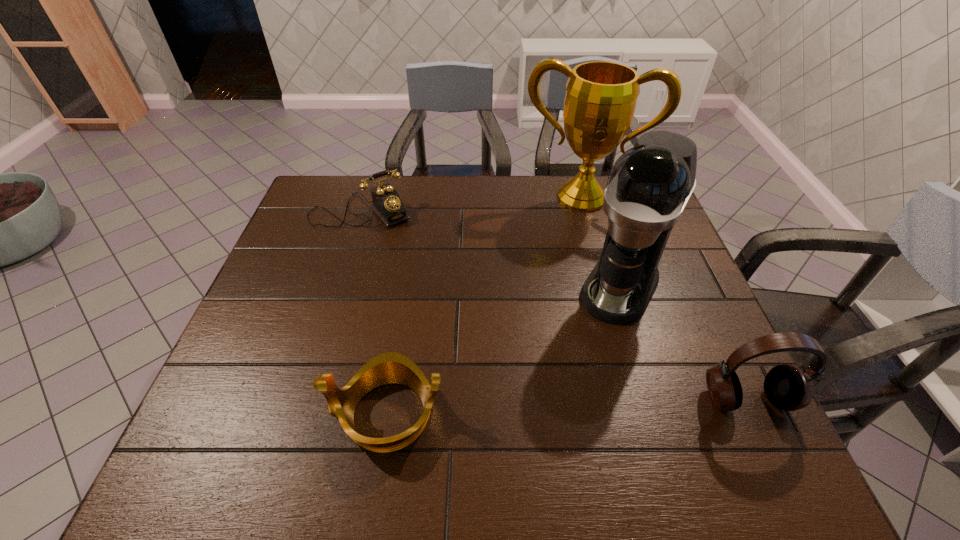
Identify the location of vacant area located 0.300m place cup under the spout of the third nearest object. (551, 414).

You are a GUI agent. You are given a task and a screenshot of the screen. Output one action in this format:
    pyautogui.click(x=<x>, y=<y>)
    Task: Click on the vacant position located 0.050m on the dial of the telephone
    This screenshot has width=960, height=540.
    Given the screenshot: What is the action you would take?
    pyautogui.click(x=393, y=235)

Where is `free location located 0.120m on the dial of the telephone`? This screenshot has width=960, height=540. free location located 0.120m on the dial of the telephone is located at coordinates (403, 248).

At what (x,y) coordinates should I click in order to perform the action: click on vacant space located 0.060m on the dial of the telephone. Please return your answer as a coordinate pair (x, y). Looking at the image, I should click on (395, 237).

At what (x,y) coordinates should I click in order to perform the action: click on free region located 0.400m on the front-facing side of the award. Please return your answer as a coordinate pair (x, y). This screenshot has height=540, width=960. Looking at the image, I should click on (550, 309).

The image size is (960, 540). Identify the location of vacant area located 0.240m on the front-facing side of the award. (560, 266).

Where is `vacant space located on the front-facing side of the award`? The width and height of the screenshot is (960, 540). vacant space located on the front-facing side of the award is located at coordinates (560, 266).

The width and height of the screenshot is (960, 540). I want to click on telephone at the far edge, so click(387, 204).

Where is `award at the far edge`? This screenshot has width=960, height=540. award at the far edge is located at coordinates (601, 96).

Find the location of a particular element. Image resolution: width=960 pixels, height=540 pixels. tiara that is at the near edge is located at coordinates (390, 367).